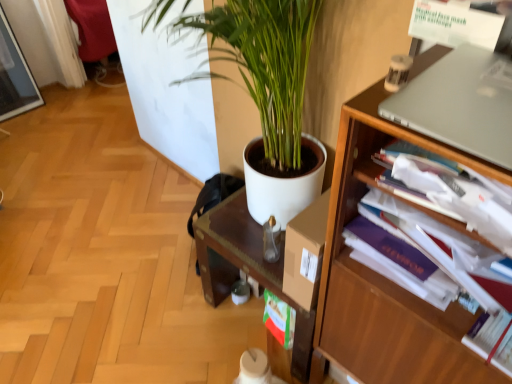
The width and height of the screenshot is (512, 384). In order to click on free space that is to the left of white matte plant pot at center in this screenshot , I will do (172, 321).